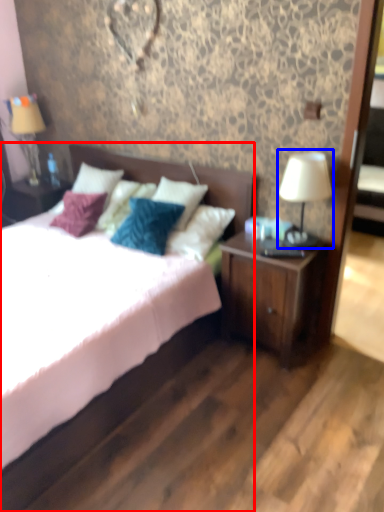
Question: Which object appears farthest to the camera in this image, bed (highlighted by a red box) or table lamp (highlighted by a blue box)?

Choices:
 (A) bed
 (B) table lamp

Answer: (B)